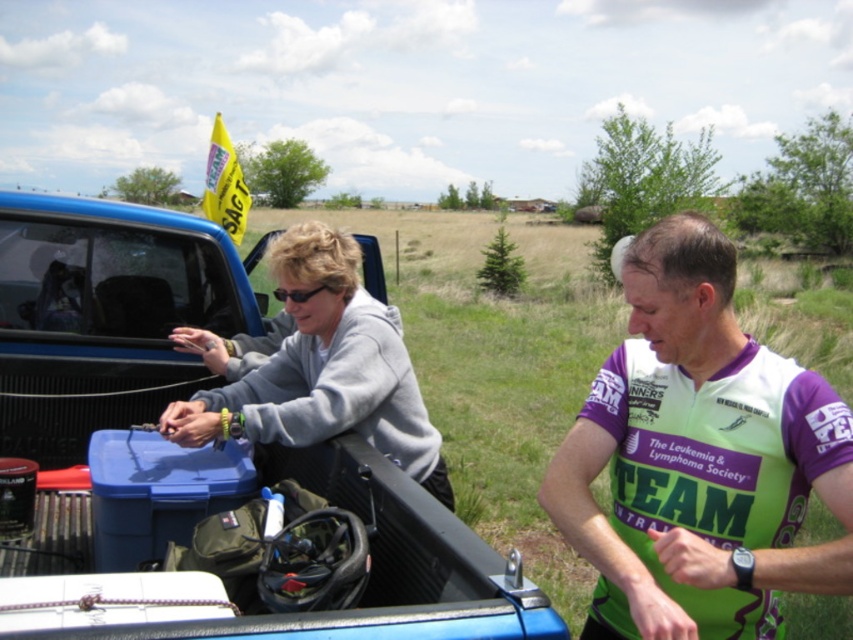
You are trying to determine if the blue matte truck bed at center can accommodate the gray matte jacket at upper left horizontally. Based on the scene, can the truck bed fit the jacket without folding it?

The blue matte truck bed at center is wider than the gray matte jacket at upper left, so it can fit the jacket horizontally without folding.